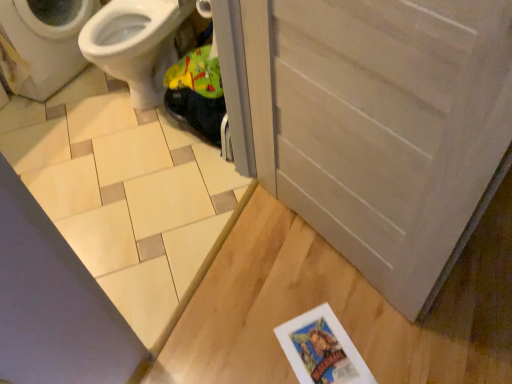
Question: Considering the positions of point (170, 8) and point (73, 248), is point (170, 8) closer or farther from the camera than point (73, 248)?

Choices:
 (A) closer
 (B) farther

Answer: (B)

Question: From a real-world perspective, is white glossy bidet at upper left positioned above or below beige ceramic tile at lower left?

Choices:
 (A) below
 (B) above

Answer: (B)

Question: Which object is positioned farthest from the white glossy bidet at upper left?

Choices:
 (A) white matte screen door at lower right
 (B) beige ceramic tile at lower left

Answer: (A)

Question: Which of these objects is positioned closest to the white matte screen door at lower right?

Choices:
 (A) white glossy bidet at upper left
 (B) beige ceramic tile at lower left

Answer: (B)